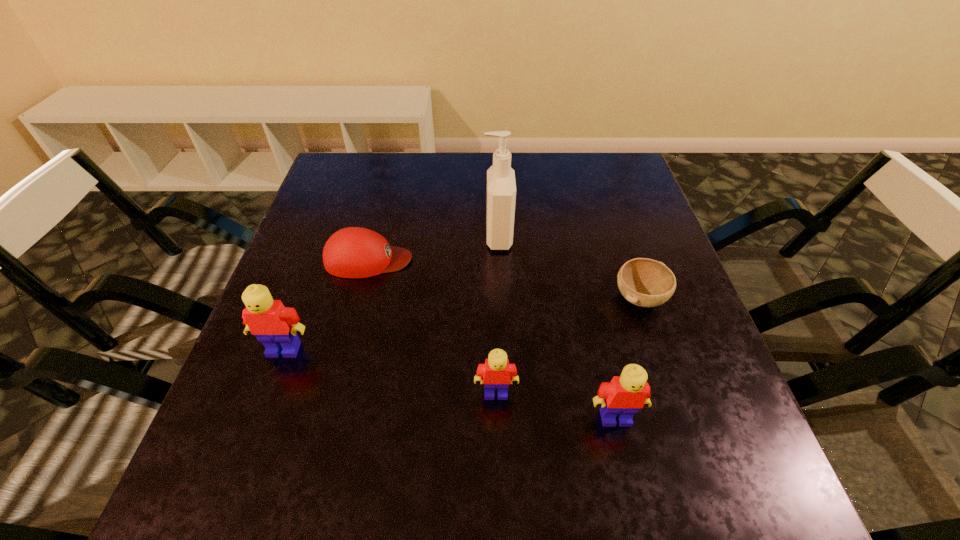
Where is `free space that satisfies the following two spatial constraints: 1. on the back side of the shortest object; 2. on the front-facing side of the baseball cap`? This screenshot has width=960, height=540. free space that satisfies the following two spatial constraints: 1. on the back side of the shortest object; 2. on the front-facing side of the baseball cap is located at coordinates (627, 260).

Image resolution: width=960 pixels, height=540 pixels. I want to click on free space that satisfies the following two spatial constraints: 1. on the front label of the cleansing agent; 2. on the back side of the shortest object, so click(500, 298).

This screenshot has width=960, height=540. I want to click on blank area in the image that satisfies the following two spatial constraints: 1. on the front label of the tallest object; 2. on the right side of the bowl, so click(500, 298).